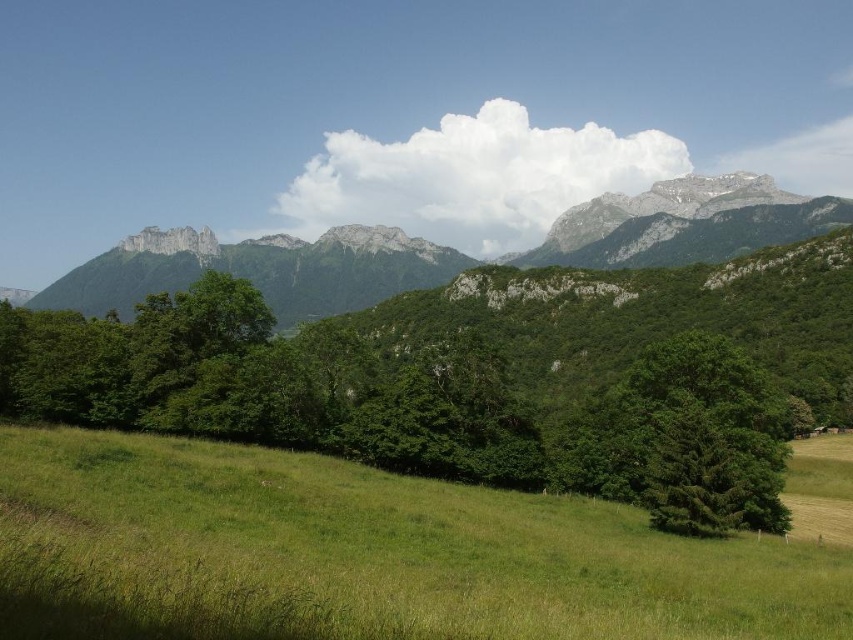
Does point (294, 536) lie in front of point (258, 269)?

Yes.

Where is `green grassy field at lower center`? Image resolution: width=853 pixels, height=640 pixels. green grassy field at lower center is located at coordinates (363, 554).

Is point (148, 589) positioned before point (618, 403)?

Yes.

Who is shorter, green grassy field at lower center or green leafy tree at center-right?

Standing shorter between the two is green grassy field at lower center.

Identify the location of green grassy field at lower center. The image size is (853, 640). 363,554.

Is rugged stone mountain range at center bigger than green leafy tree at center-right?

Yes.

Image resolution: width=853 pixels, height=640 pixels. Describe the element at coordinates (260, 269) in the screenshot. I see `rugged stone mountain range at center` at that location.

Which is behind, point (302, 308) or point (685, 353)?

The point (302, 308) is behind.

This screenshot has width=853, height=640. I want to click on rugged stone mountain range at center, so click(260, 269).